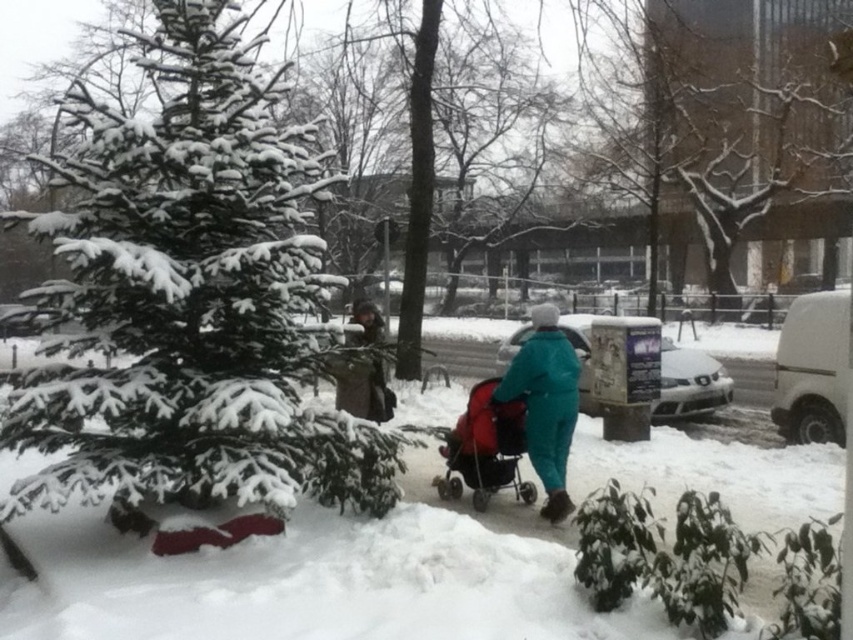
Question: Does teal fabric stroller at center appear on the right side of red fabric stroller at center?

Choices:
 (A) yes
 (B) no

Answer: (A)

Question: Can you confirm if red fabric stroller at center is thinner than brown textured coat at center?

Choices:
 (A) no
 (B) yes

Answer: (A)

Question: Which of these objects is positioned closest to the red fabric stroller at center?

Choices:
 (A) brown textured coat at center
 (B) teal fabric stroller at center
 (C) green matte tree at center

Answer: (B)

Question: Estimate the real-world distances between objects in this image. Which object is farther from the green matte tree at center?

Choices:
 (A) red fabric stroller at center
 (B) brown textured coat at center
 (C) teal fabric stroller at center

Answer: (C)

Question: Can you confirm if green matte tree at center is positioned to the right of teal fabric stroller at center?

Choices:
 (A) no
 (B) yes

Answer: (A)

Question: Considering the real-world distances, which object is closest to the green matte tree at center?

Choices:
 (A) red fabric stroller at center
 (B) teal fabric stroller at center
 (C) brown textured coat at center

Answer: (C)